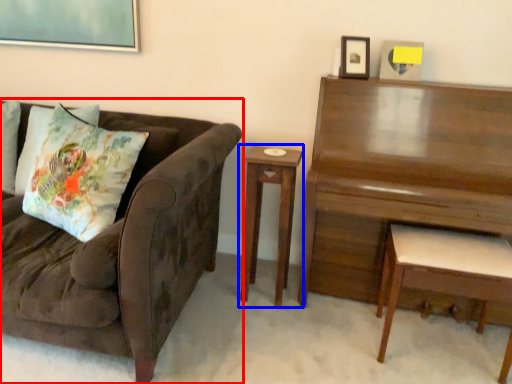
Question: Which object appears farthest to the camera in this image, studio couch (highlighted by a red box) or nightstand (highlighted by a blue box)?

Choices:
 (A) studio couch
 (B) nightstand

Answer: (B)